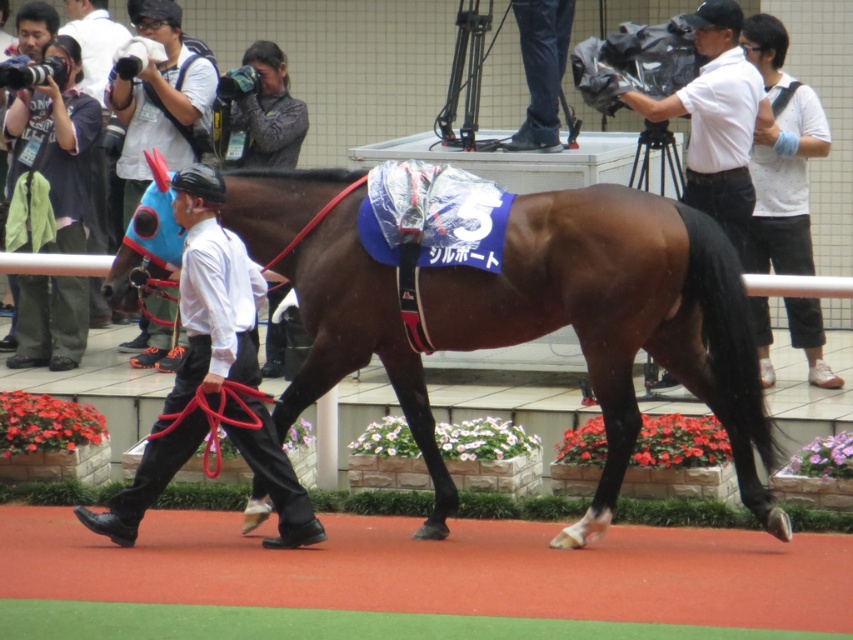
You are a photographer at the horse racing event. You need to take a photo of the two handlers wearing white dotted shirt at upper right and white smooth shirt at upper right. Which handler should you focus on first if you want to capture someone who is closer to the camera?

The white smooth shirt at upper right is closer to the camera because it is shorter than the white dotted shirt at upper right, which is much taller. Since the white dotted shirt at upper right is taller, it might be positioned further back, making the shorter one in front.